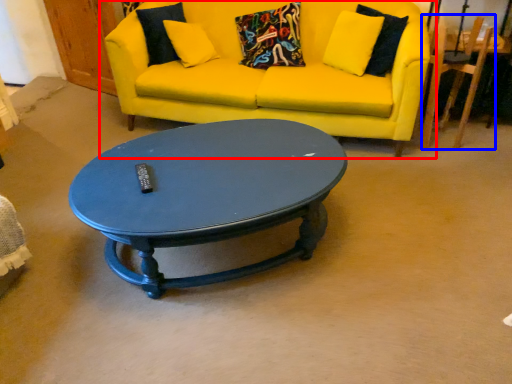
Question: Which point is further to the camera, studio couch (highlighted by a red box) or armchair (highlighted by a blue box)?

Choices:
 (A) studio couch
 (B) armchair

Answer: (B)